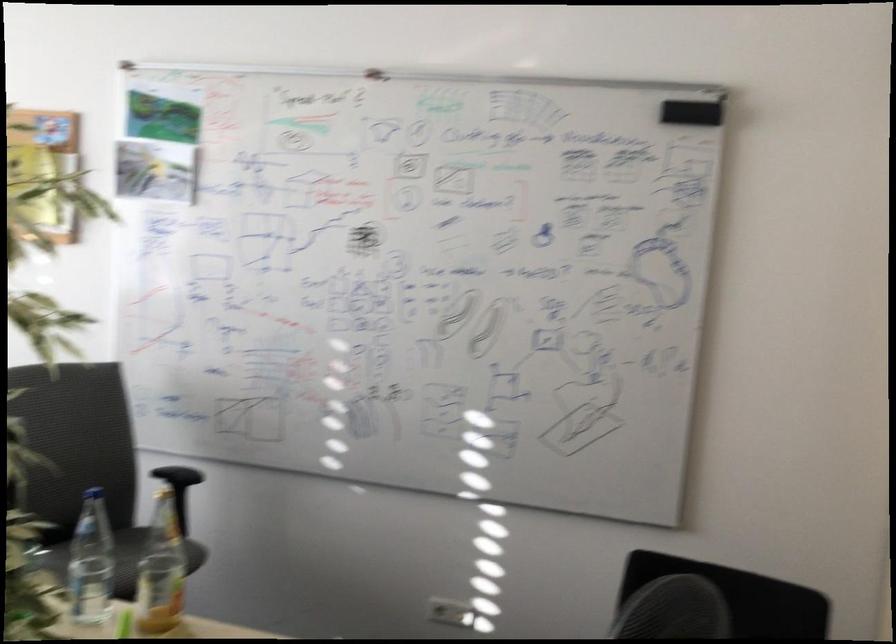
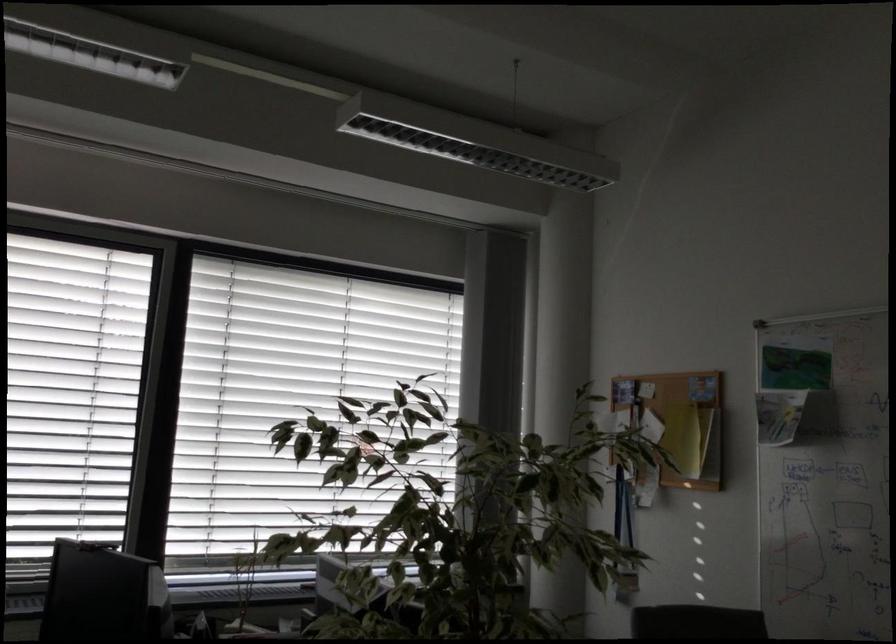
The first image is from the beginning of the video and the second image is from the end. How did the camera likely rotate when shooting the video?

The rotation direction of the camera is left-up.